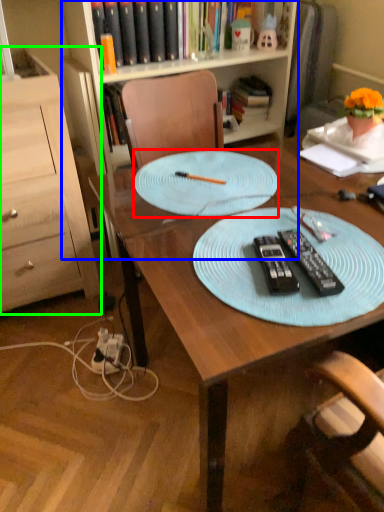
Question: Estimate the real-world distances between objects in this image. Which object is farther from glass plate (highlighted by a red box), bookcase (highlighted by a blue box) or cabinetry (highlighted by a green box)?

Choices:
 (A) bookcase
 (B) cabinetry

Answer: (A)